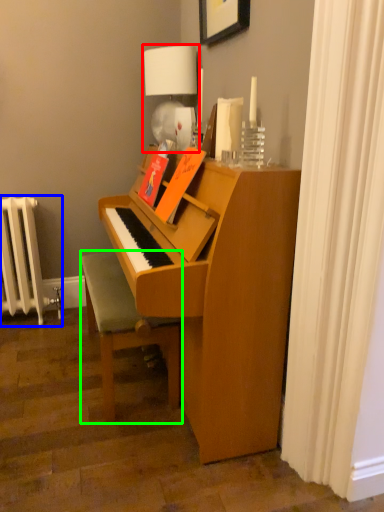
Question: Which is nearer to the table lamp (highlighted by a red box)? radiator (highlighted by a blue box) or furniture (highlighted by a green box).

Choices:
 (A) radiator
 (B) furniture

Answer: (B)